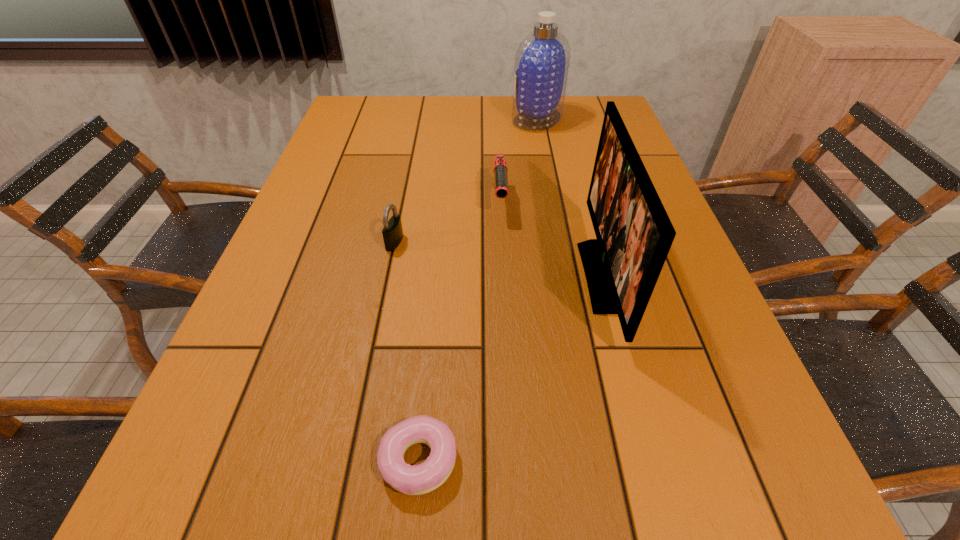
Where is `the farthest object`? This screenshot has height=540, width=960. the farthest object is located at coordinates (542, 60).

Locate an element on the screen. monitor is located at coordinates (634, 234).

What are the coordinates of `the third object from left to right` in the screenshot? It's located at (500, 169).

Locate an element on the screen. This screenshot has width=960, height=540. the leftmost object is located at coordinates (392, 232).

This screenshot has height=540, width=960. What are the coordinates of `the nearest object` in the screenshot? It's located at (420, 479).

Find the location of `the shortest object`. the shortest object is located at coordinates (420, 479).

Locate an element on the screen. vacant space located 0.180m on the front of the farthest object is located at coordinates (546, 165).

Find the location of a particular element. The height and width of the screenshot is (540, 960). blank space located on the front-facing side of the monitor is located at coordinates (415, 276).

Locate an element on the screen. vacant space located on the front-facing side of the monitor is located at coordinates (561, 276).

At what (x,y) coordinates should I click in order to perform the action: click on vacant space situated on the front-facing side of the monitor. Please return your answer as a coordinate pair (x, y). The height and width of the screenshot is (540, 960). Looking at the image, I should click on (438, 276).